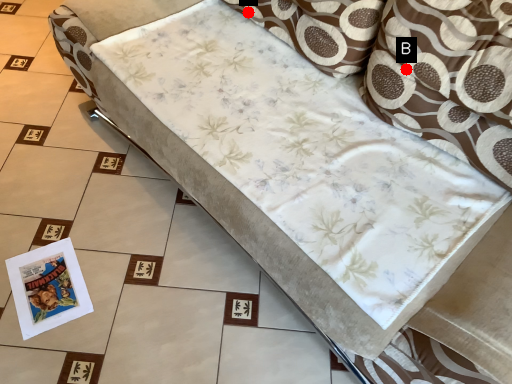
Question: Two points are circled on the image, labeled by A and B beside each circle. Which point is closer to the camera taking this photo?

Choices:
 (A) A is closer
 (B) B is closer

Answer: (B)